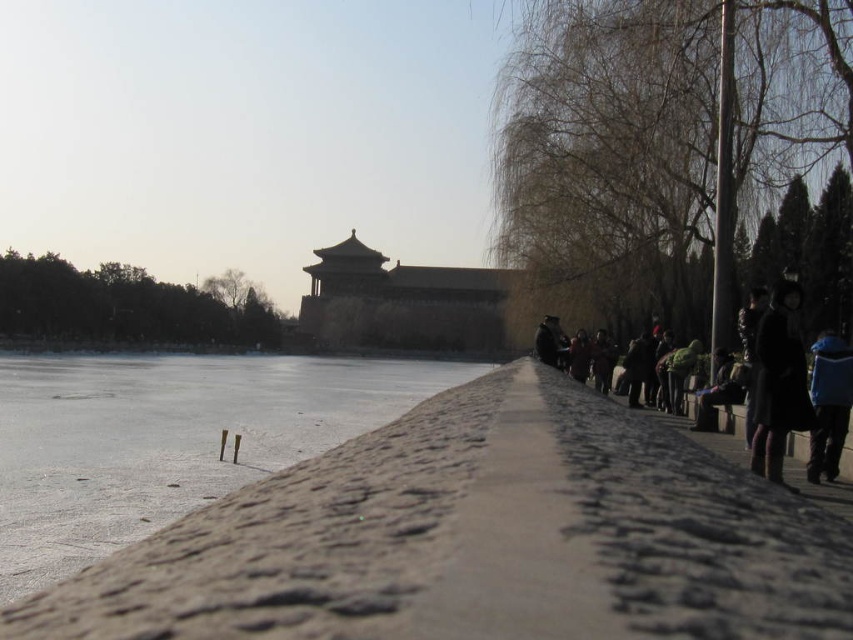
You are a visitor at this historical site and want to take a photo of both the dark blue coat at right and the blue fabric jacket at right. Since you want both items to be clearly visible in the photo, which one should you zoom in on more to ensure the smaller item is properly framed?

The dark blue coat at right occupies less space than the blue fabric jacket at right, so you should zoom in more on the dark blue coat at right to ensure it is properly framed alongside the larger jacket.

From the picture: You are a visitor at the historical site and want to take a photo of the frozen ice at lower left and dark wool coat at right. Which object is taller in the scene?

The frozen ice at lower left is taller than the dark wool coat at right.

You are standing on the frozen lake and see two coats hanging on the stone wall at the right side of the image. Which one is more to the right between the dark blue coat at right and the dark wool coat at right?

The dark blue coat at right is more to the right because it is positioned on the right side of the dark wool coat at right.